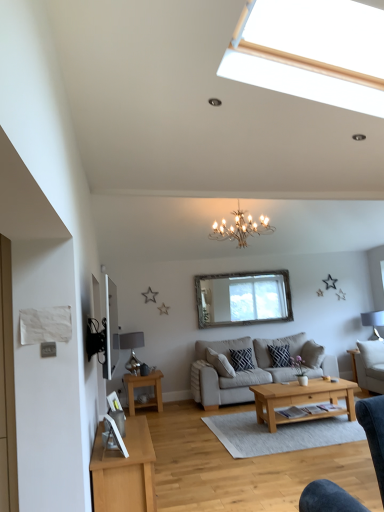
Where is `gold metallic chandelier at upper center`? The width and height of the screenshot is (384, 512). gold metallic chandelier at upper center is located at coordinates (241, 228).

The height and width of the screenshot is (512, 384). What do you see at coordinates (241, 228) in the screenshot?
I see `gold metallic chandelier at upper center` at bounding box center [241, 228].

Identify the location of white glossy picture frame at lower left. This screenshot has height=512, width=384. (115, 435).

Describe the element at coordinates (115, 435) in the screenshot. I see `white glossy picture frame at lower left` at that location.

The image size is (384, 512). I want to click on light brown wooden coffee table at center, so click(302, 400).

What do you see at coordinates (370, 366) in the screenshot? Image resolution: width=384 pixels, height=512 pixels. I see `light gray fabric armchair at right` at bounding box center [370, 366].

Where is `metallic silver lamp at lower left, the 1th lamp in the front-to-back sequence`? metallic silver lamp at lower left, the 1th lamp in the front-to-back sequence is located at coordinates (132, 348).

I want to click on white fabric lampshade at right, the 2th lamp viewed from the left, so click(x=373, y=321).

In order to face beige fabric couch at center, should I rotate leftwards or rightwards?

To align with it, rotate right about 9.290°.

Find the location of `gold metallic chandelier at upper center`. gold metallic chandelier at upper center is located at coordinates (241, 228).

Can you confirm if clear glass window at center is bigger than metallic silver lamp at lower left, the 1th lamp in the front-to-back sequence?

Yes.

Who is shorter, clear glass window at center or metallic silver lamp at lower left, arranged as the second lamp when viewed from the right?

With less height is metallic silver lamp at lower left, arranged as the second lamp when viewed from the right.

Considering the positions of objects clear glass window at center and metallic silver lamp at lower left, which is the 1th lamp in left-to-right order, in the image provided, who is more to the left, clear glass window at center or metallic silver lamp at lower left, which is the 1th lamp in left-to-right order,?

metallic silver lamp at lower left, which is the 1th lamp in left-to-right order, is more to the left.

The image size is (384, 512). I want to click on window screen that is behind the metallic silver lamp at lower left, the 1th lamp in the front-to-back sequence, so click(243, 298).

From a real-world perspective, is gold metallic chandelier at upper center under clear glass window at center?

No.

From the image's perspective, is gold metallic chandelier at upper center above or below clear glass window at center?

Clearly, from the image's perspective, gold metallic chandelier at upper center is above clear glass window at center.

Between gold metallic chandelier at upper center and clear glass window at center, which one has smaller width?

clear glass window at center is thinner.

Is light brown wooden coffee table at center bigger than gold metallic chandelier at upper center?

Actually, light brown wooden coffee table at center might be smaller than gold metallic chandelier at upper center.

Locate an element on the screen. light fixture above the light brown wooden coffee table at center (from a real-world perspective) is located at coordinates (241, 228).

Does point (250, 389) appear closer or farther from the camera than point (252, 223)?

Point (250, 389) appears to be closer to the viewer than point (252, 223).

Which of these two, dark blue textured pillow at center or metallic silver lamp at lower left, the 1th lamp in the front-to-back sequence, is thinner?

dark blue textured pillow at center.

Consider the image. Considering the sizes of objects dark blue textured pillow at center and metallic silver lamp at lower left, the 1th lamp in the front-to-back sequence, in the image provided, who is shorter, dark blue textured pillow at center or metallic silver lamp at lower left, the 1th lamp in the front-to-back sequence,?

dark blue textured pillow at center is shorter.

Is dark blue textured pillow at center facing towards metallic silver lamp at lower left, arranged as the second lamp when viewed from the right?

No, dark blue textured pillow at center does not turn towards metallic silver lamp at lower left, arranged as the second lamp when viewed from the right.

Image resolution: width=384 pixels, height=512 pixels. I want to click on pillow lying below the metallic silver lamp at lower left, positioned as the 2th lamp in back-to-front order (from the image's perspective), so click(x=241, y=359).

Considering the sizes of objects light brown wooden coffee table at center and dark blue textured pillow at center in the image provided, who is smaller, light brown wooden coffee table at center or dark blue textured pillow at center?

Smaller between the two is dark blue textured pillow at center.

From the image's perspective, who appears lower, light brown wooden coffee table at center or dark blue textured pillow at center?

light brown wooden coffee table at center, from the image's perspective.

Which is behind, light brown wooden coffee table at center or dark blue textured pillow at center?

dark blue textured pillow at center.

Is point (291, 398) positioned after point (232, 356)?

No, (291, 398) is closer to viewer.

Are beige fabric couch at center and clear glass window at center far apart?

No, there isn't a large distance between beige fabric couch at center and clear glass window at center.

Is beige fabric couch at center positioned with its back to clear glass window at center?

No, beige fabric couch at center's orientation is not away from clear glass window at center.

In terms of size, does beige fabric couch at center appear bigger or smaller than clear glass window at center?

Clearly, beige fabric couch at center is larger in size than clear glass window at center.

From a real-world perspective, between beige fabric couch at center and clear glass window at center, who is vertically lower?

beige fabric couch at center.

From a real-world perspective, who is located lower, beige fabric couch at center or white fabric lampshade at right, positioned as the 1th lamp in right-to-left order?

From a 3D spatial view, beige fabric couch at center is below.

Based on the photo, could you tell me if beige fabric couch at center is turned towards white fabric lampshade at right, placed as the second lamp when sorted from front to back?

No.

From the image's perspective, which is below, beige fabric couch at center or white fabric lampshade at right, placed as the second lamp when sorted from front to back?

beige fabric couch at center.

Locate an element on the screen. window screen above the metallic silver lamp at lower left, the 1th lamp in the front-to-back sequence (from a real-world perspective) is located at coordinates (243, 298).

This screenshot has height=512, width=384. In order to click on window screen below the gold metallic chandelier at upper center (from the image's perspective) in this screenshot , I will do `click(243, 298)`.

Considering their positions, is white fabric lampshade at right, marked as the first lamp in a back-to-front arrangement, positioned further to light wood/texture side table at lower left than gold metallic chandelier at upper center?

Among the two, white fabric lampshade at right, marked as the first lamp in a back-to-front arrangement, is located further to light wood/texture side table at lower left.

Considering their positions, is light brown wooden coffee table at center positioned further to white glossy picture frame at lower left than metallic silver lamp at lower left, the 1th lamp in the front-to-back sequence?

metallic silver lamp at lower left, the 1th lamp in the front-to-back sequence.

Looking at the image, which one is located closer to light gray fabric armchair at right, gold metallic chandelier at upper center or white glossy picture frame at lower left?

gold metallic chandelier at upper center.

Based on their spatial positions, is light gray fabric armchair at right or metallic silver lamp at lower left, arranged as the second lamp when viewed from the right, closer to white glossy picture frame at lower left?

Based on the image, metallic silver lamp at lower left, arranged as the second lamp when viewed from the right, appears to be nearer to white glossy picture frame at lower left.

Based on their spatial positions, is light gray fabric armchair at right or gold metallic chandelier at upper center further from clear glass window at center?

light gray fabric armchair at right lies further to clear glass window at center than the other object.

When comparing their distances from light gray fabric armchair at right, does white glossy picture frame at lower left or white fabric lampshade at right, marked as the first lamp in a back-to-front arrangement, seem further?

white glossy picture frame at lower left is positioned further to the anchor light gray fabric armchair at right.

Looking at the image, which one is located closer to beige fabric couch at center, clear glass window at center or white glossy picture frame at lower left?

clear glass window at center is closer to beige fabric couch at center.

From the image, which object appears to be nearer to white glossy picture frame at lower left, beige fabric couch at center or light brown wooden coffee table at center?

The object closer to white glossy picture frame at lower left is light brown wooden coffee table at center.

The image size is (384, 512). In order to click on table situated between metallic silver lamp at lower left, positioned as the 2th lamp in back-to-front order, and light gray fabric armchair at right from left to right in this screenshot , I will do `click(144, 386)`.

Where is `pillow between light wood/texture side table at lower left and light gray fabric armchair at right from left to right`? This screenshot has width=384, height=512. pillow between light wood/texture side table at lower left and light gray fabric armchair at right from left to right is located at coordinates (241, 359).

Locate an element on the screen. The width and height of the screenshot is (384, 512). table located between metallic silver lamp at lower left, positioned as the 2th lamp in back-to-front order, and clear glass window at center in the left-right direction is located at coordinates (144, 386).

The image size is (384, 512). Find the location of `studio couch between dark blue textured pillow at center and light gray fabric armchair at right from left to right`. studio couch between dark blue textured pillow at center and light gray fabric armchair at right from left to right is located at coordinates [x=252, y=369].